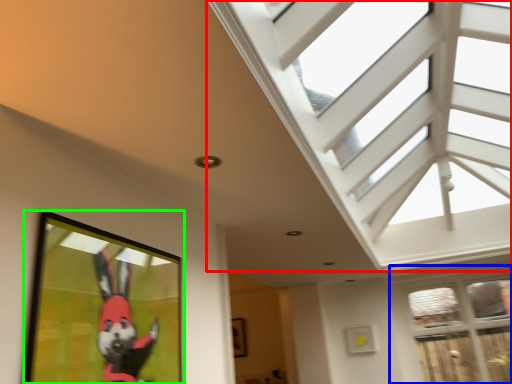
Question: Estimate the real-world distances between objects in this image. Which object is closer to window (highlighted by a red box), window (highlighted by a blue box) or picture frame (highlighted by a green box)?

Choices:
 (A) window
 (B) picture frame

Answer: (A)